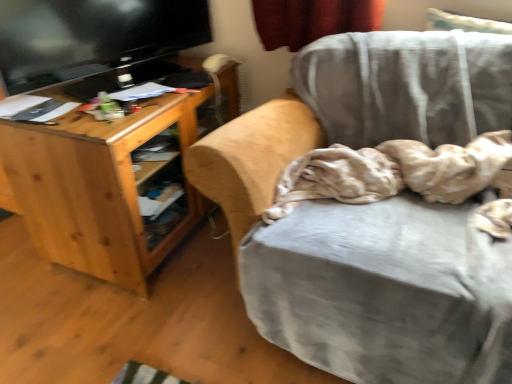
Question: Is beige soft fabric at center bigger than velvet gray chair at center?

Choices:
 (A) yes
 (B) no

Answer: (B)

Question: Considering the relative sizes of beige soft fabric at center and velvet gray chair at center in the image provided, is beige soft fabric at center smaller than velvet gray chair at center?

Choices:
 (A) no
 (B) yes

Answer: (B)

Question: Is beige soft fabric at center positioned beyond the bounds of velvet gray chair at center?

Choices:
 (A) no
 (B) yes

Answer: (A)

Question: Are beige soft fabric at center and velvet gray chair at center making contact?

Choices:
 (A) yes
 (B) no

Answer: (B)

Question: Are beige soft fabric at center and velvet gray chair at center far apart?

Choices:
 (A) no
 (B) yes

Answer: (A)

Question: Can you confirm if beige soft fabric at center is thinner than velvet gray chair at center?

Choices:
 (A) yes
 (B) no

Answer: (A)

Question: Does natural wood desk at left have a larger size compared to black glossy television at upper left?

Choices:
 (A) yes
 (B) no

Answer: (A)

Question: Is natural wood desk at left turned away from black glossy television at upper left?

Choices:
 (A) yes
 (B) no

Answer: (B)

Question: From a real-world perspective, is natural wood desk at left below black glossy television at upper left?

Choices:
 (A) no
 (B) yes

Answer: (B)

Question: Can you confirm if natural wood desk at left is positioned to the right of black glossy television at upper left?

Choices:
 (A) no
 (B) yes

Answer: (A)

Question: Does natural wood desk at left contain black glossy television at upper left?

Choices:
 (A) yes
 (B) no

Answer: (B)

Question: Can you confirm if natural wood desk at left is thinner than black glossy television at upper left?

Choices:
 (A) no
 (B) yes

Answer: (A)

Question: Does natural wood desk at left have a larger size compared to beige soft fabric at center?

Choices:
 (A) no
 (B) yes

Answer: (B)